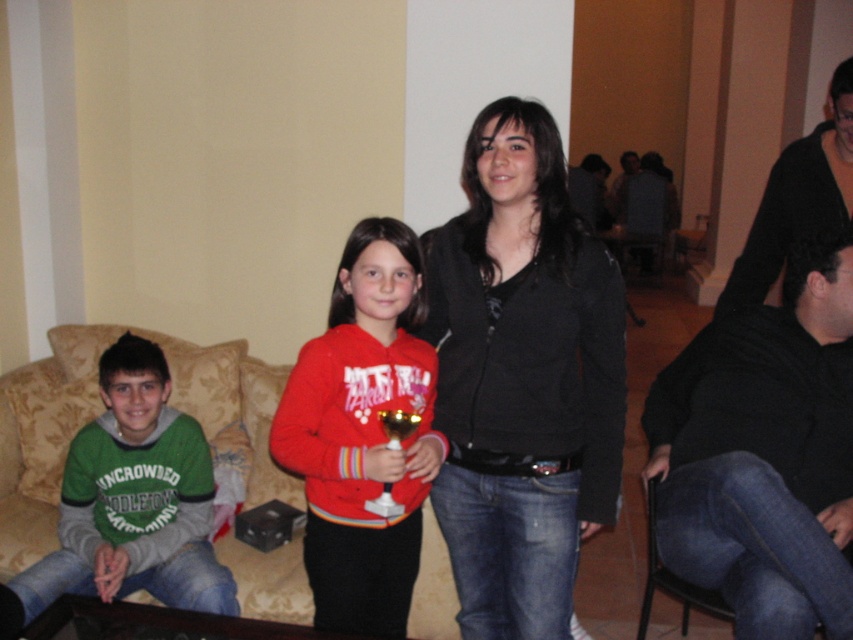
What is the color of the jacket at the point specified by the coordinates (521, 378)?

The point at coordinates (521, 378) is on a black matte jacket at center.

You are a photographer setting up a shoot in this living room. You have a black matte jacket at center and a beige fabric couch at lower left in your frame. Which object should you adjust to ensure both are in focus if your camera has a limited depth of field?

The black matte jacket at center is closer to the viewer than the beige fabric couch at lower left. To ensure both are in focus, you should adjust the camera settings to increase the depth of field or move the black matte jacket at center further away so it aligns with the distance of the beige fabric couch at lower left.